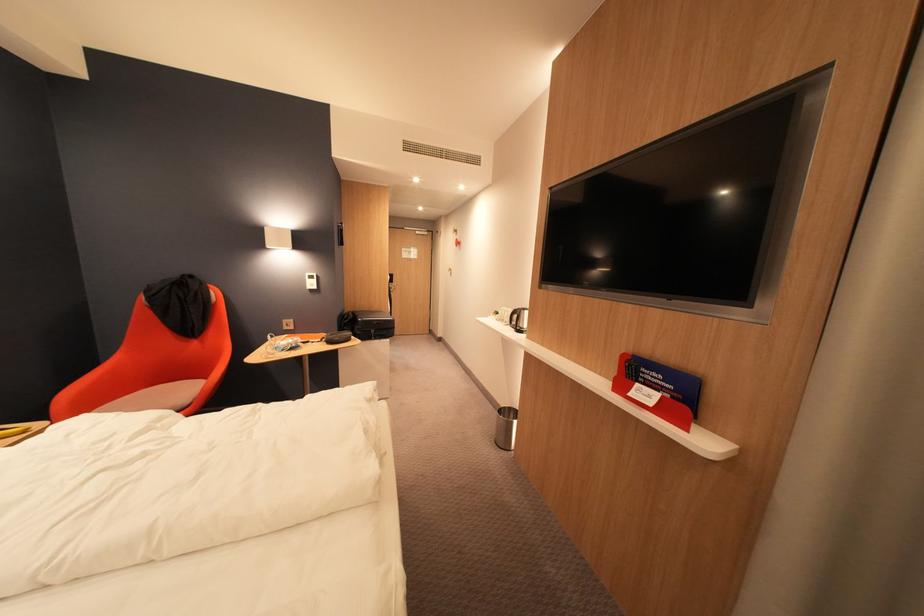
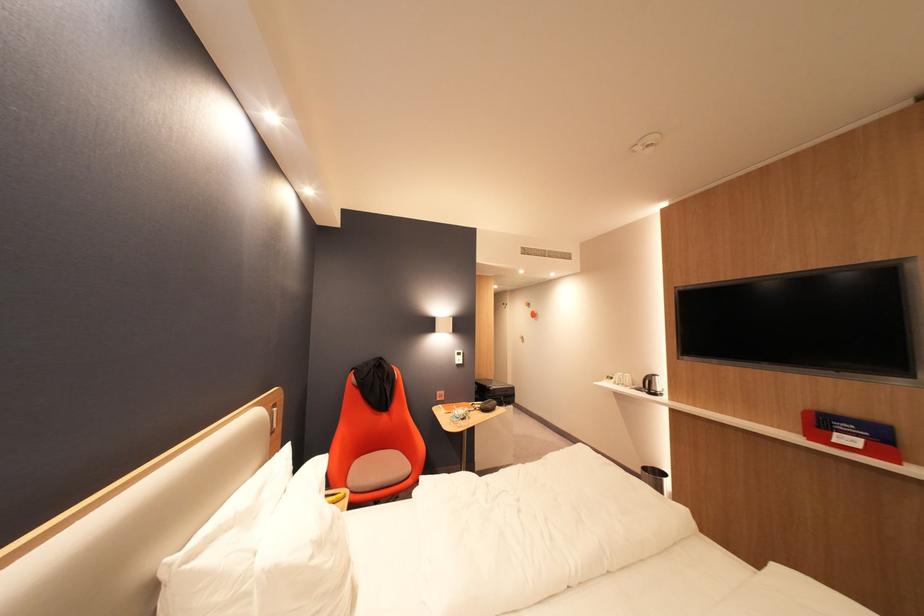
The point at (x=528, y=330) is marked in the first image. Where is the corresponding point in the second image?

(662, 392)